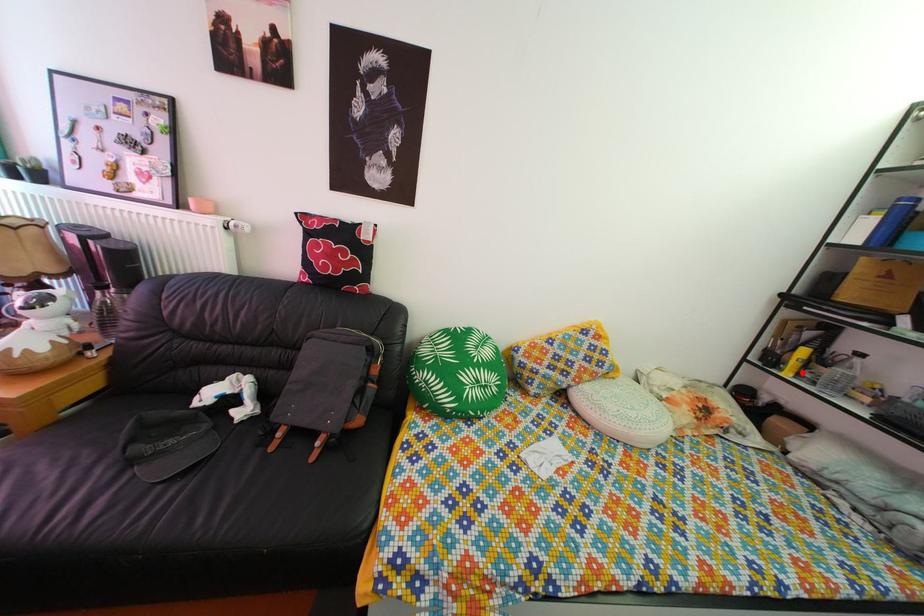
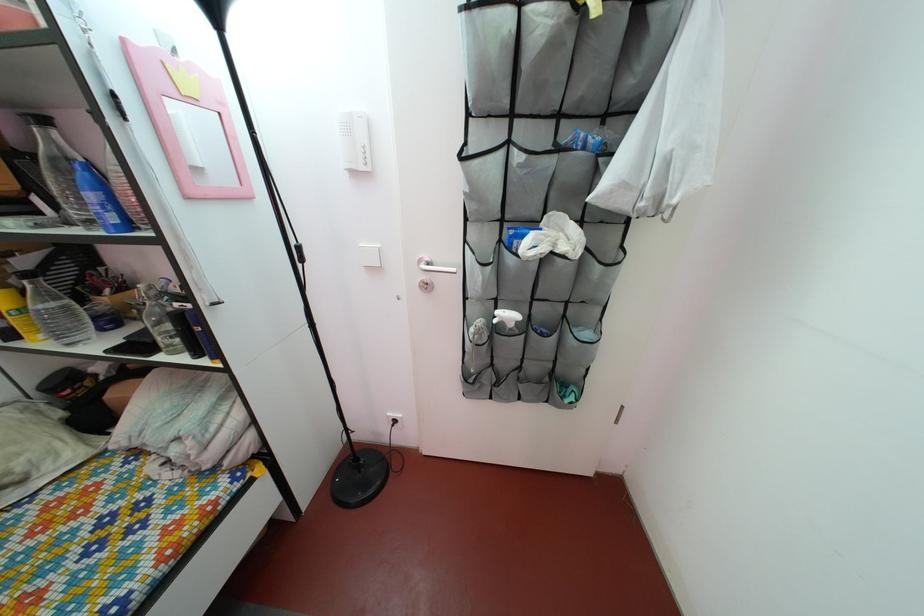
Question: I am providing you with two images of the same scene from different viewpoints. A red point is shown in image1. For the corresponding object point in image2, is it positioned nearer or farther from the camera?

Choices:
 (A) Nearer
 (B) Farther

Answer: (A)